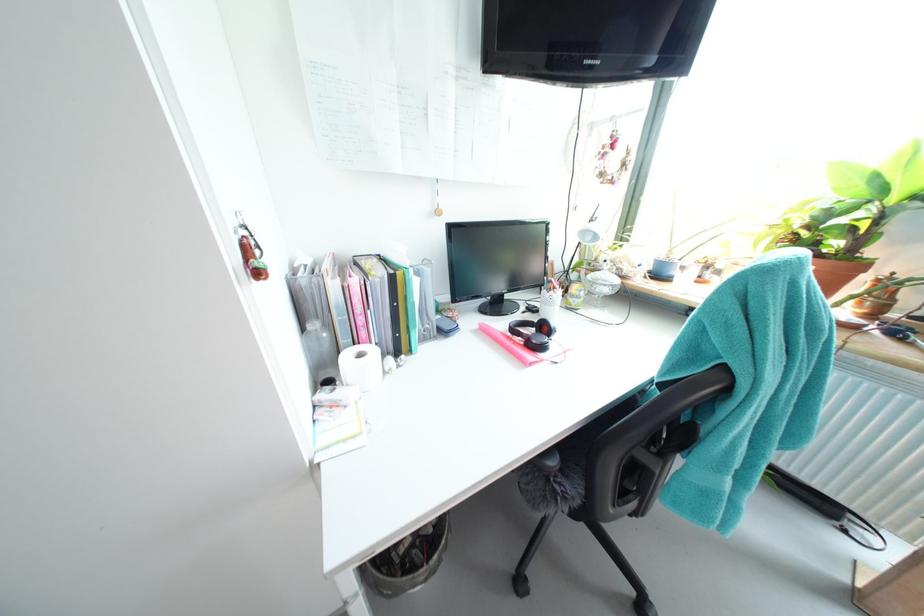
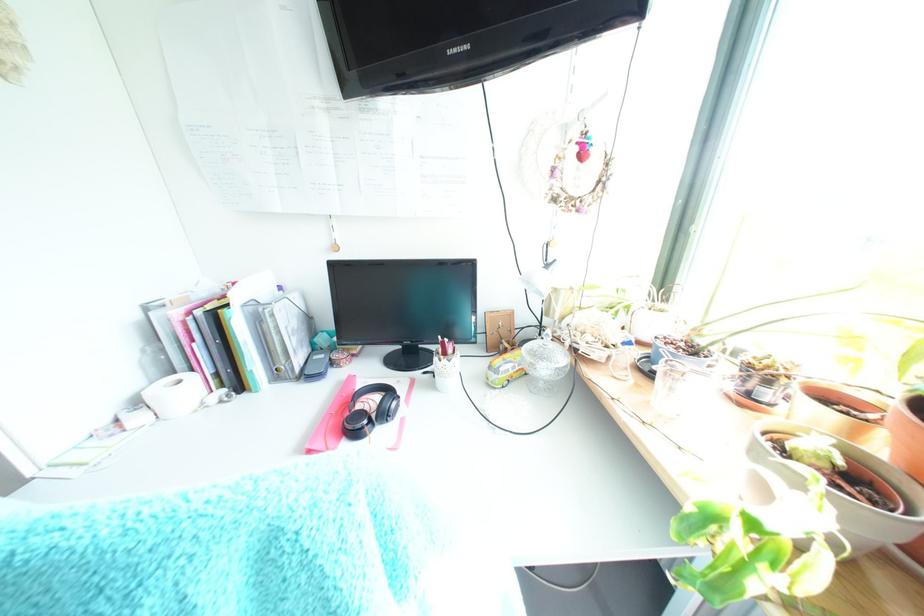
The images are taken continuously from a first-person perspective. In which direction are you moving?

The movement direction of the cameraman is right, forward.